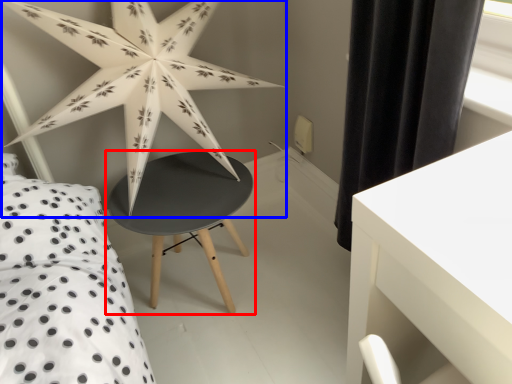
Question: Which object appears closest to the camera in this image, table (highlighted by a red box) or star (highlighted by a blue box)?

Choices:
 (A) table
 (B) star

Answer: (B)